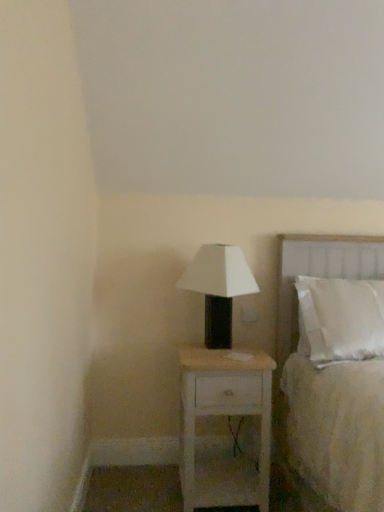
Question: From the image's perspective, is white wood nightstand at center above or below white matte table lamp at center?

Choices:
 (A) below
 (B) above

Answer: (A)

Question: From a real-world perspective, is white wood nightstand at center positioned above or below white matte table lamp at center?

Choices:
 (A) below
 (B) above

Answer: (A)

Question: Which object is the closest to the white matte table lamp at center?

Choices:
 (A) white fabric bed at right
 (B) white wood nightstand at center

Answer: (B)

Question: Which of these objects is positioned farthest from the white matte table lamp at center?

Choices:
 (A) white wood nightstand at center
 (B) white fabric bed at right

Answer: (B)